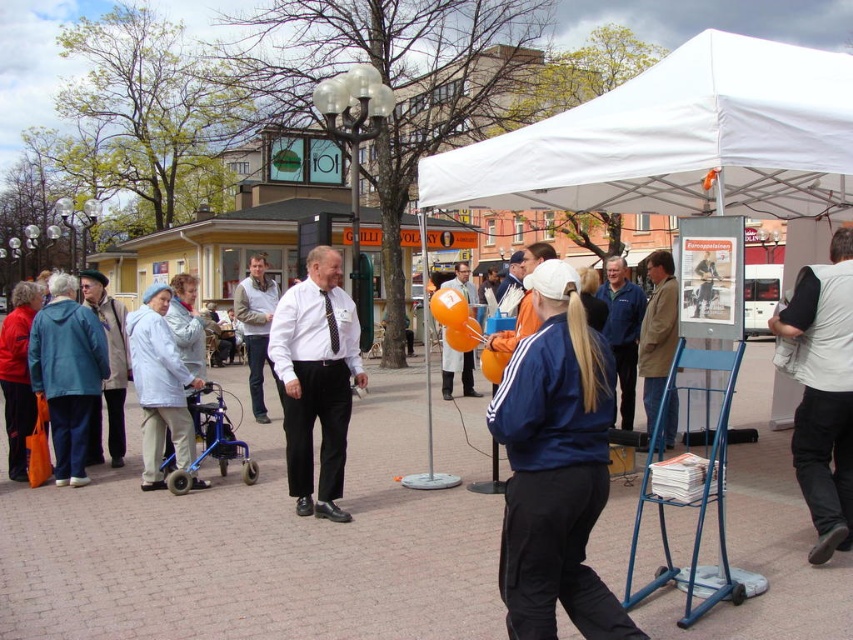
Question: Which point is farther to the camera?

Choices:
 (A) (152, 465)
 (B) (250, 372)
 (C) (810, 282)

Answer: (B)

Question: Can you confirm if teal fabric jacket at left is positioned above light blue fabric jacket at left?

Choices:
 (A) no
 (B) yes

Answer: (B)

Question: Estimate the real-world distances between objects in this image. Which object is closer to the navy blue track suit at center?

Choices:
 (A) teal fabric jacket at left
 (B) white fleece vest at center

Answer: (A)

Question: Among these objects, which one is farthest from the camera?

Choices:
 (A) white fabric tent at upper right
 (B) teal fabric jacket at left
 (C) white shirt and tie at center

Answer: (B)

Question: Does white fabric tent at upper right come in front of white shirt and tie at center?

Choices:
 (A) yes
 (B) no

Answer: (A)

Question: Does white fabric tent at upper right have a greater width compared to teal fabric jacket at left?

Choices:
 (A) no
 (B) yes

Answer: (B)